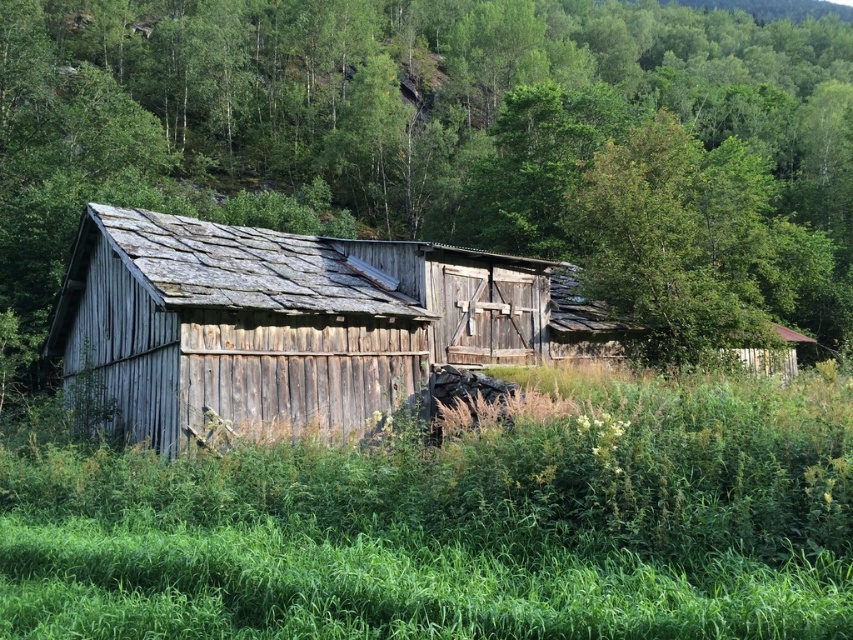
Question: Among these objects, which one is nearest to the camera?

Choices:
 (A) weathered wood barn at center
 (B) green grass at lower center

Answer: (B)

Question: Which point is farther to the camera?

Choices:
 (A) green grass at lower center
 (B) green wood tree at center
 (C) weathered wood barn at center

Answer: (B)

Question: Can you confirm if green wood tree at center is positioned to the right of green grass at lower center?

Choices:
 (A) yes
 (B) no

Answer: (A)

Question: Where is green grass at lower center located in relation to weathered wood barn at center in the image?

Choices:
 (A) above
 (B) below

Answer: (B)

Question: Which of the following is the closest to the observer?

Choices:
 (A) (447, 301)
 (B) (343, 65)
 (C) (670, 556)

Answer: (C)

Question: Is green grass at lower center above weathered wood barn at center?

Choices:
 (A) yes
 (B) no

Answer: (B)